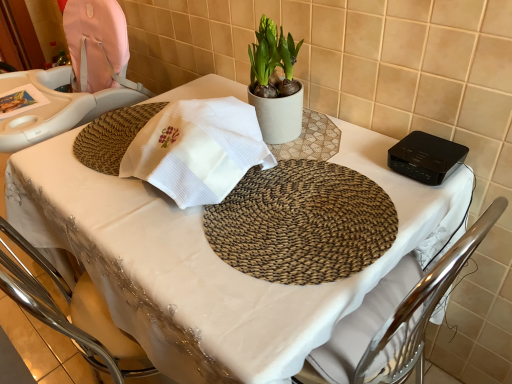
Question: Considering the relative positions of matte beige pot at center and black plastic device at upper right in the image provided, is matte beige pot at center behind black plastic device at upper right?

Choices:
 (A) yes
 (B) no

Answer: (A)

Question: Does matte beige pot at center appear on the right side of black plastic device at upper right?

Choices:
 (A) no
 (B) yes

Answer: (A)

Question: Is black plastic device at upper right inside matte beige pot at center?

Choices:
 (A) no
 (B) yes

Answer: (A)

Question: Can you confirm if matte beige pot at center is taller than black plastic device at upper right?

Choices:
 (A) no
 (B) yes

Answer: (B)

Question: Is matte beige pot at center placed right next to black plastic device at upper right?

Choices:
 (A) no
 (B) yes

Answer: (A)

Question: Is matte beige pot at center smaller than black plastic device at upper right?

Choices:
 (A) yes
 (B) no

Answer: (B)

Question: Is black plastic device at upper right to the left of matte beige pot at center from the viewer's perspective?

Choices:
 (A) no
 (B) yes

Answer: (A)

Question: Is black plastic device at upper right thinner than matte beige pot at center?

Choices:
 (A) yes
 (B) no

Answer: (B)

Question: Does black plastic device at upper right turn towards matte beige pot at center?

Choices:
 (A) no
 (B) yes

Answer: (A)

Question: Does black plastic device at upper right have a greater height compared to matte beige pot at center?

Choices:
 (A) no
 (B) yes

Answer: (A)

Question: Is the position of black plastic device at upper right more distant than that of matte beige pot at center?

Choices:
 (A) yes
 (B) no

Answer: (B)

Question: Is matte beige pot at center at the back of black plastic device at upper right?

Choices:
 (A) no
 (B) yes

Answer: (A)

Question: Considering the positions of point (408, 158) and point (267, 86), is point (408, 158) closer or farther from the camera than point (267, 86)?

Choices:
 (A) farther
 (B) closer

Answer: (B)